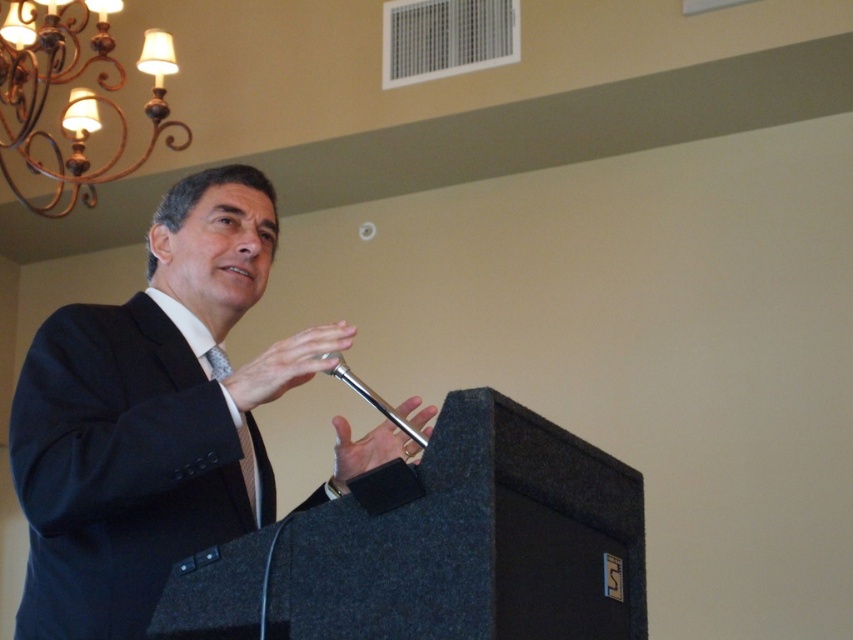
Question: Does gold wrought iron chandelier at upper left appear on the right side of silky gray tie at center?

Choices:
 (A) no
 (B) yes

Answer: (A)

Question: Which of these objects is positioned farthest from the black suit at center?

Choices:
 (A) silky gray tie at center
 (B) silver metallic microphone at center

Answer: (B)

Question: Can you confirm if black suit at center is smaller than silver metallic microphone at center?

Choices:
 (A) yes
 (B) no

Answer: (B)

Question: Which point appears closest to the camera in this image?

Choices:
 (A) (61, 67)
 (B) (325, 356)

Answer: (B)

Question: Is gold wrought iron chandelier at upper left further to the viewer compared to silky gray tie at center?

Choices:
 (A) yes
 (B) no

Answer: (A)

Question: Which of the following is the farthest from the observer?

Choices:
 (A) silky gray tie at center
 (B) black suit at center
 (C) silver metallic microphone at center

Answer: (A)